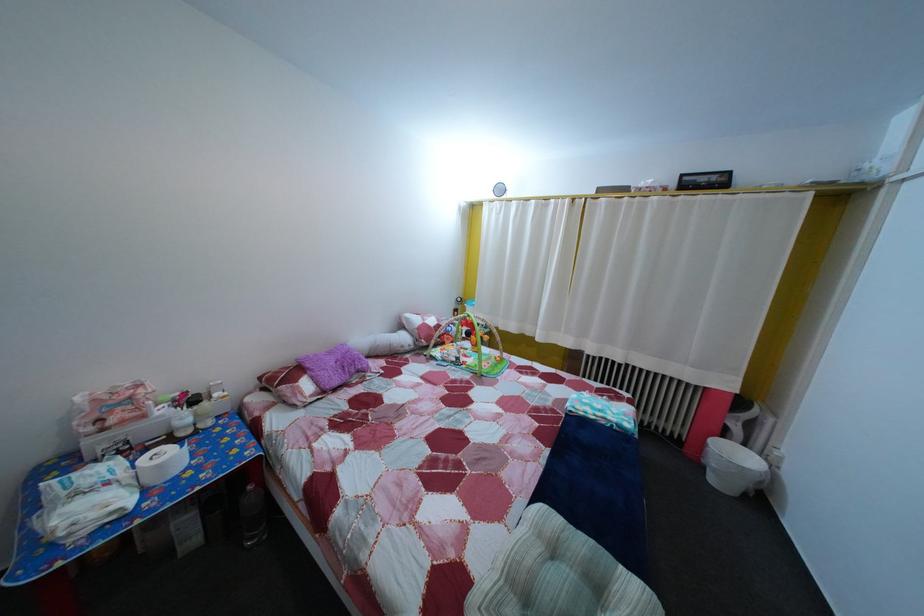
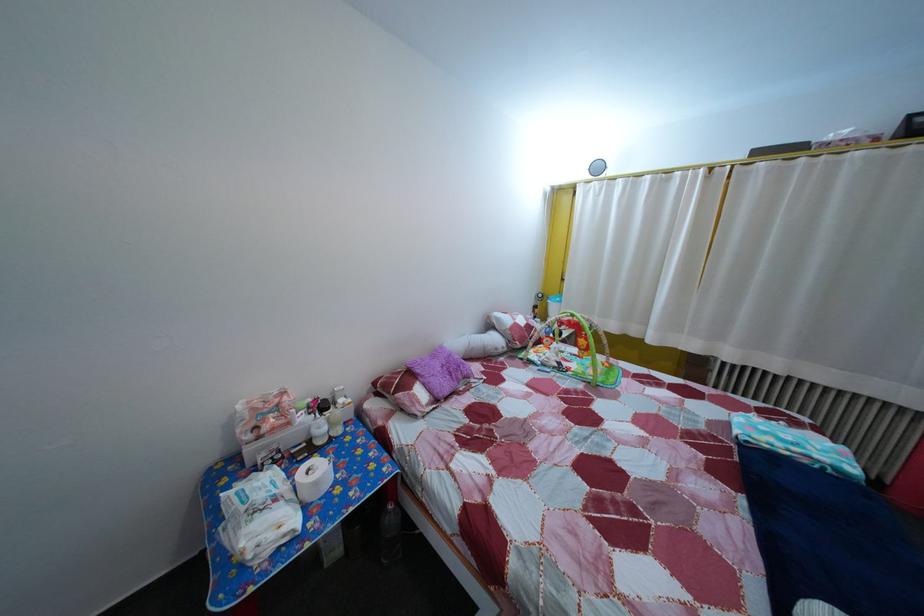
Find the pixel in the second image that matches point (412, 346) in the first image.

(505, 347)